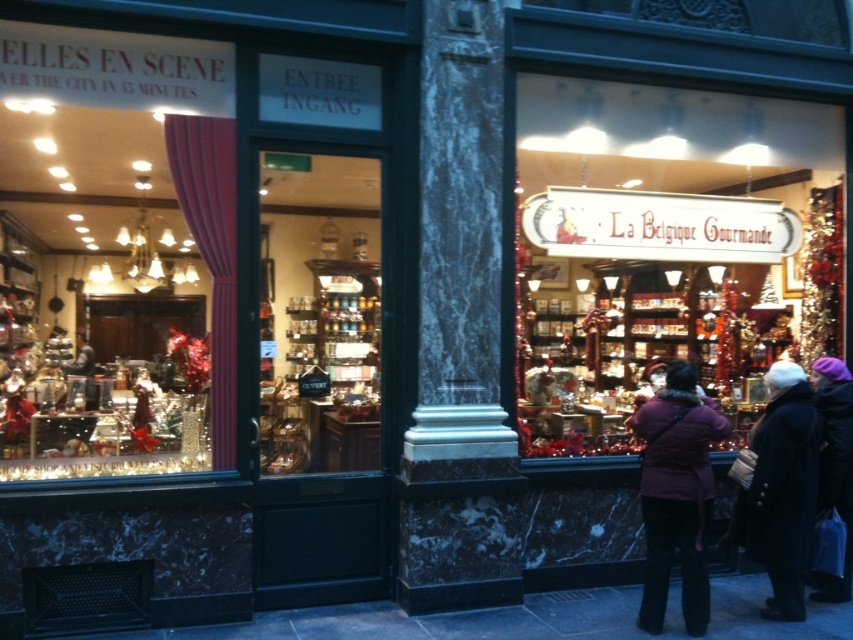
Is point (432, 445) closer to viewer compared to point (842, 488)?

Yes, point (432, 445) is closer to viewer.

Who is lower down, marble column at center or purple woolen hat at upper right?

purple woolen hat at upper right is below.

Between point (440, 221) and point (815, 589), which one is positioned in front?

Point (440, 221) is in front.

You are a GUI agent. You are given a task and a screenshot of the screen. Output one action in this format:
    pyautogui.click(x=<x>, y=<y>)
    Task: Click on the marble column at center
    Image resolution: width=853 pixels, height=640 pixels.
    Given the screenshot: What is the action you would take?
    pyautogui.click(x=460, y=332)

Where is `marble column at center`? The image size is (853, 640). marble column at center is located at coordinates (460, 332).

Between marble column at center and dark wool coat at lower right, which one has more height?

marble column at center is taller.

Who is more forward, (x=430, y=310) or (x=799, y=465)?

Point (x=799, y=465) is in front.

The width and height of the screenshot is (853, 640). I want to click on marble column at center, so click(x=460, y=332).

Can you confirm if matte white signboard at center is positioned to the right of purple fuzzy coat at lower right?

No, matte white signboard at center is not to the right of purple fuzzy coat at lower right.

Is matte white signboard at center taller than purple fuzzy coat at lower right?

Yes.

At what (x,y) coordinates should I click in order to perform the action: click on matte white signboard at center. Please return your answer as a coordinate pair (x, y). The image size is (853, 640). Looking at the image, I should click on (664, 246).